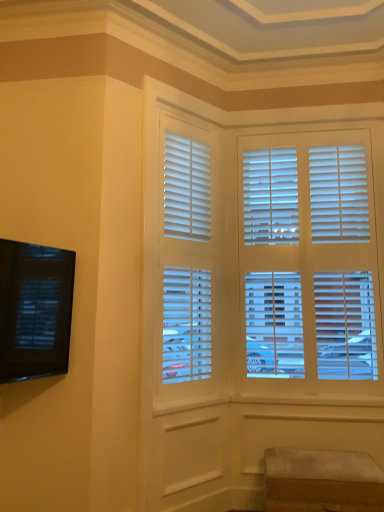
Question: From the image's perspective, is suede ottoman at lower right below white matte blinds at center?

Choices:
 (A) yes
 (B) no

Answer: (A)

Question: Considering the relative positions of suede ottoman at lower right and white matte blinds at center in the image provided, is suede ottoman at lower right to the left of white matte blinds at center from the viewer's perspective?

Choices:
 (A) no
 (B) yes

Answer: (A)

Question: Is suede ottoman at lower right facing away from white matte blinds at center?

Choices:
 (A) yes
 (B) no

Answer: (B)

Question: Does suede ottoman at lower right have a smaller size compared to white matte blinds at center?

Choices:
 (A) yes
 (B) no

Answer: (A)

Question: From a real-world perspective, does suede ottoman at lower right sit lower than white matte blinds at center?

Choices:
 (A) yes
 (B) no

Answer: (A)

Question: Is point (334, 464) positioned closer to the camera than point (29, 279)?

Choices:
 (A) farther
 (B) closer

Answer: (A)

Question: From the image's perspective, is suede ottoman at lower right positioned above or below black glossy tv at left?

Choices:
 (A) below
 (B) above

Answer: (A)

Question: Considering the relative positions of suede ottoman at lower right and black glossy tv at left in the image provided, is suede ottoman at lower right to the left or to the right of black glossy tv at left?

Choices:
 (A) right
 (B) left

Answer: (A)

Question: In the image, is suede ottoman at lower right positioned in front of or behind black glossy tv at left?

Choices:
 (A) front
 (B) behind

Answer: (B)

Question: Do you think black glossy tv at left is within suede ottoman at lower right, or outside of it?

Choices:
 (A) inside
 (B) outside

Answer: (B)

Question: From their relative heights in the image, would you say black glossy tv at left is taller or shorter than suede ottoman at lower right?

Choices:
 (A) short
 (B) tall

Answer: (B)

Question: From the image's perspective, is black glossy tv at left positioned above or below suede ottoman at lower right?

Choices:
 (A) below
 (B) above

Answer: (B)

Question: Does point (49, 284) appear closer or farther from the camera than point (301, 504)?

Choices:
 (A) closer
 (B) farther

Answer: (A)

Question: From a real-world perspective, is white matte blinds at center positioned above or below suede ottoman at lower right?

Choices:
 (A) below
 (B) above

Answer: (B)

Question: In the image, is white matte blinds at center positioned in front of or behind suede ottoman at lower right?

Choices:
 (A) behind
 (B) front

Answer: (A)